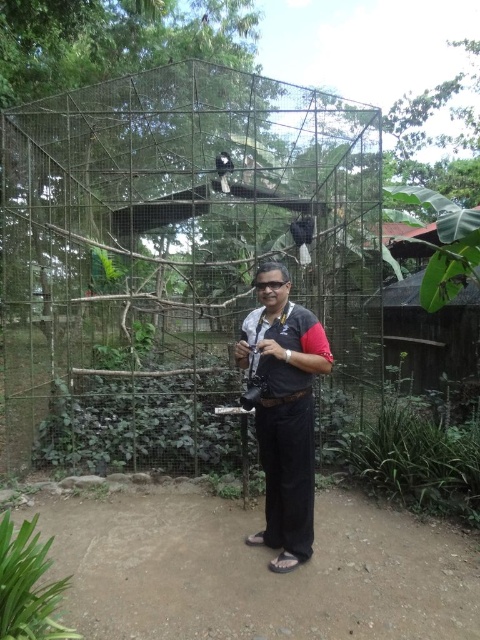
You are a photographer trying to capture a wide shot of the metal mesh cage at center and the black fabric shirt at center. Based on their sizes, which object will appear larger in your photo?

The metal mesh cage at center will appear larger in the photo because its width surpasses that of the black fabric shirt at center.

You are a photographer trying to capture a clear image of the metal mesh cage at center and the black fabric shirt at center. Which object should you focus on first to ensure it appears sharp in your photo?

The metal mesh cage at center is closer to the viewer than the black fabric shirt at center, so you should focus on the metal mesh cage at center first to ensure it appears sharp in your photo.

You are a photographer standing at the position of the man in the image. You want to take a photo of the metal mesh cage at center without any obstructions. Since the black fabric shirt at center is in the way, can you step back to ensure the shirt doesn not block the cage in the photo?

The metal mesh cage at center is 10.01 feet away from the black fabric shirt at center. Since the shirt is only 10.01 feet away from the cage, stepping back might not be sufficient to avoid obstruction. You may need to adjust your angle or move sideways to ensure the black fabric shirt at center does not block the cage.